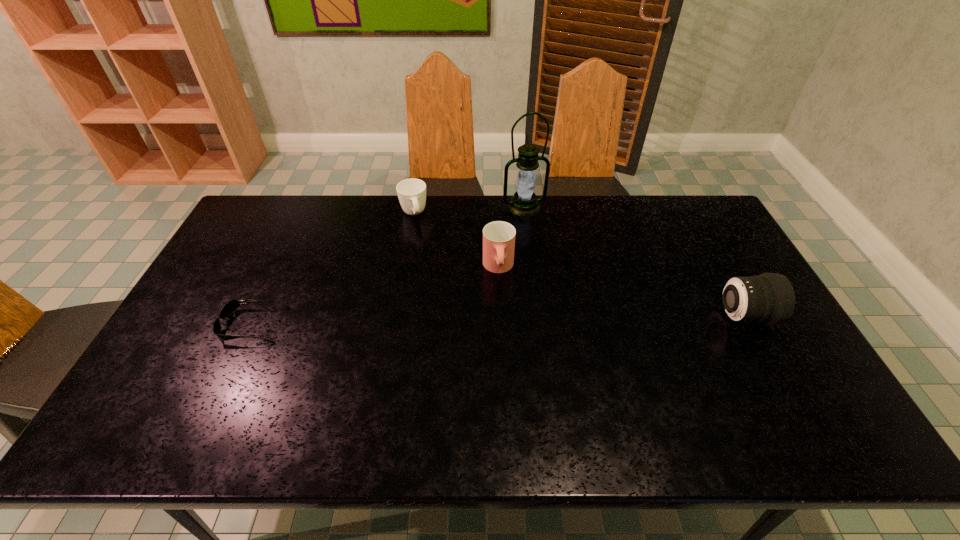
I want to click on free space on the desktop that is between the leftmost object and the telephoto lens and is positioned on the side where the tallest object emits light, so click(x=568, y=319).

The image size is (960, 540). I want to click on vacant spot on the desktop that is between the shortest object and the telephoto lens and is positioned on the side of the third nearest object with the handle, so click(x=503, y=320).

The image size is (960, 540). I want to click on vacant space on the desktop that is between the shortest object and the rightmost object and is positioned with the handle on the side of the shorter cup, so click(x=449, y=321).